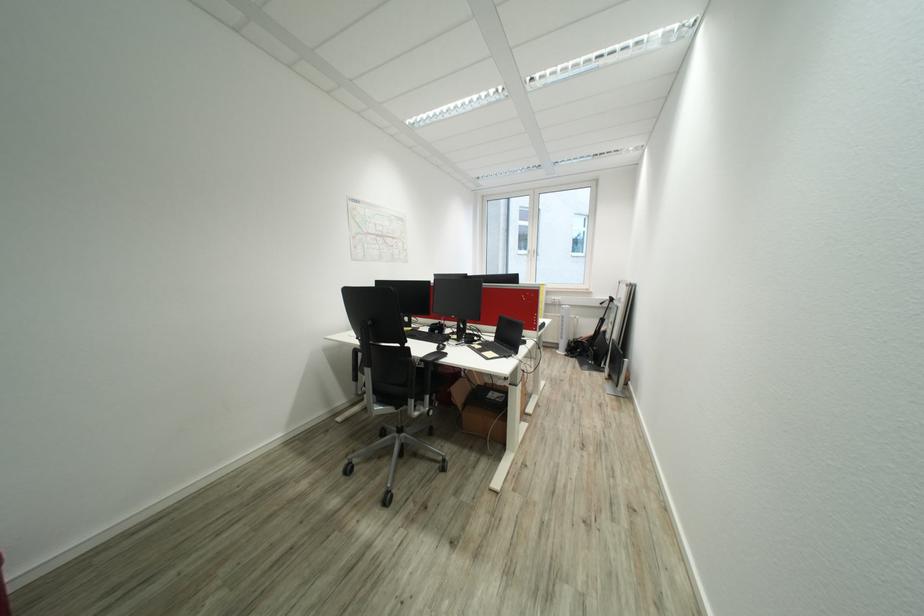
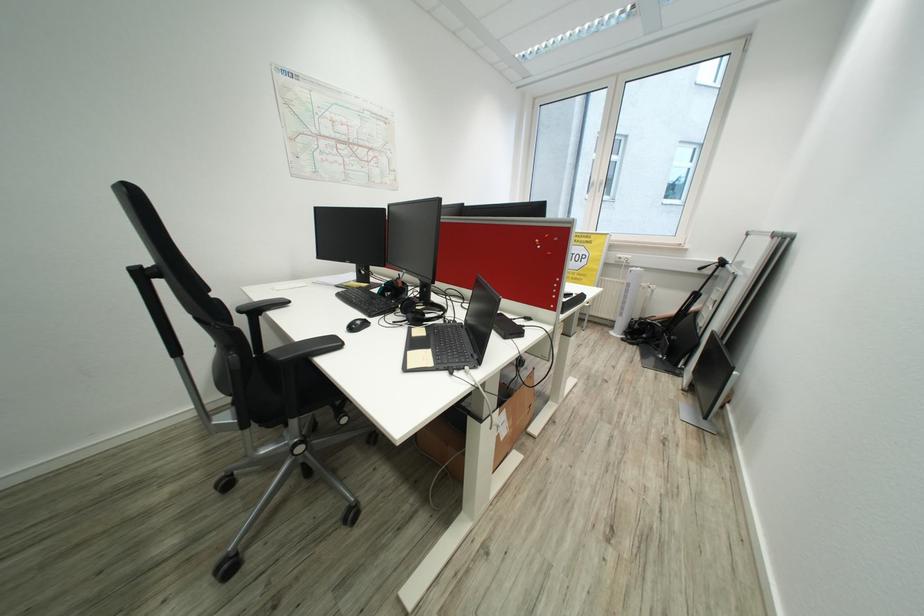
Which direction would the cameraman need to move to produce the second image?

The movement direction of the cameraman is right, forward.